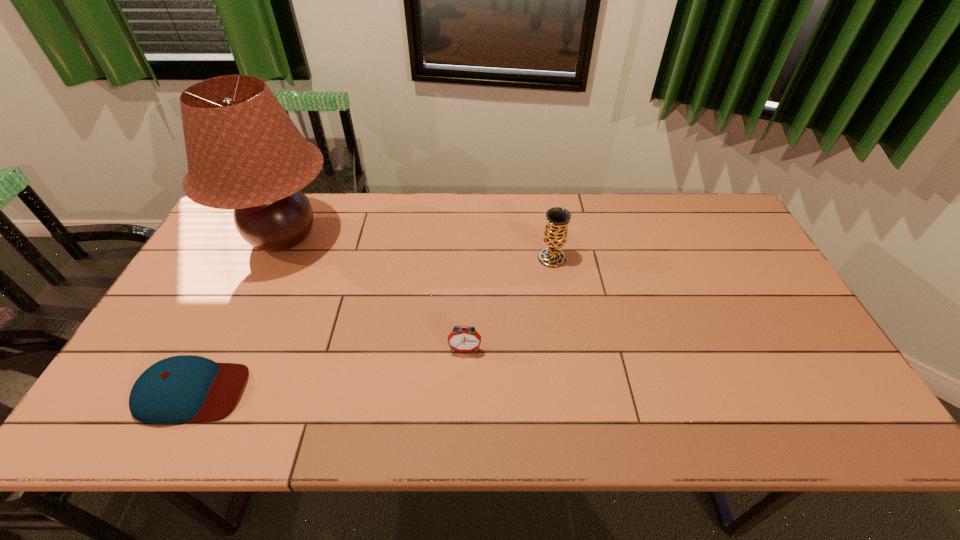
Identify the location of free spot between the tallest object and the second tallest object. This screenshot has width=960, height=540. (418, 248).

Locate an element on the screen. vacant space that is in between the second tallest object and the lampshade is located at coordinates (418, 248).

Image resolution: width=960 pixels, height=540 pixels. Find the location of `the second closest object to the nearest object`. the second closest object to the nearest object is located at coordinates 460,339.

Point out which object is positioned as the third nearest to the nearest object. Please provide its 2D coordinates. Your answer should be formatted as a tuple, i.e. [(x, y)], where the tuple contains the x and y coordinates of a point satisfying the conditions above.

[(557, 219)]

Identify the location of free space in the image that satisfies the following two spatial constraints: 1. on the front-facing side of the third shortest object; 2. on the left side of the lampshade. The height and width of the screenshot is (540, 960). (275, 258).

Where is `free space in the image that satisfies the following two spatial constraints: 1. on the front-facing side of the third shortest object; 2. on the right side of the lampshade`? free space in the image that satisfies the following two spatial constraints: 1. on the front-facing side of the third shortest object; 2. on the right side of the lampshade is located at coordinates (275, 258).

The height and width of the screenshot is (540, 960). I want to click on vacant region that satisfies the following two spatial constraints: 1. on the clock face of the second nearest object; 2. with the bill of the nearest object facing forward, so click(464, 392).

Locate an element on the screen. The width and height of the screenshot is (960, 540). vacant space that satisfies the following two spatial constraints: 1. on the front-facing side of the rightmost object; 2. on the left side of the lampshade is located at coordinates (275, 258).

Identify the location of free spot that satisfies the following two spatial constraints: 1. on the front-facing side of the tallest object; 2. on the left side of the rightmost object. The width and height of the screenshot is (960, 540). pyautogui.click(x=275, y=258).

Image resolution: width=960 pixels, height=540 pixels. What are the coordinates of `vacant space that satisfies the following two spatial constraints: 1. on the front-facing side of the rightmost object; 2. on the left side of the tallest object` in the screenshot? It's located at (275, 258).